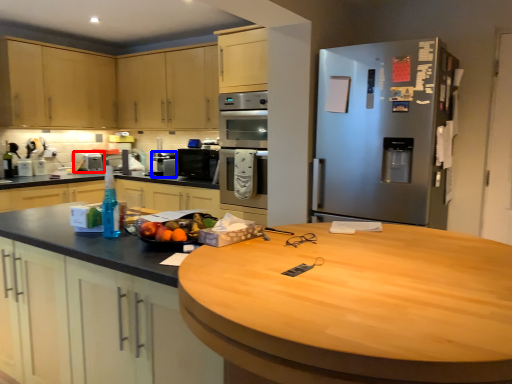
Question: Which of the following is the farthest to the observer, appliance (highlighted by a red box) or appliance (highlighted by a blue box)?

Choices:
 (A) appliance
 (B) appliance

Answer: (A)